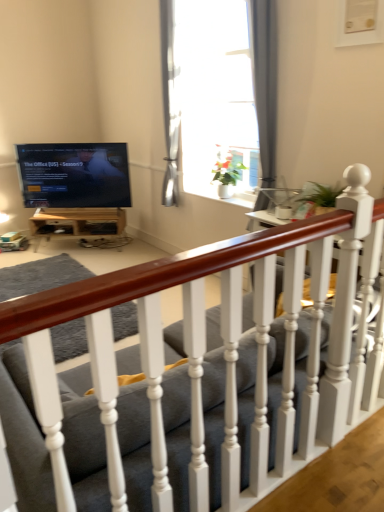
Question: Considering the relative sizes of wooden table at lower left and matte gray fabric couch at center in the image provided, is wooden table at lower left smaller than matte gray fabric couch at center?

Choices:
 (A) yes
 (B) no

Answer: (A)

Question: Considering the relative sizes of wooden table at lower left and matte gray fabric couch at center in the image provided, is wooden table at lower left shorter than matte gray fabric couch at center?

Choices:
 (A) no
 (B) yes

Answer: (B)

Question: Does wooden table at lower left appear on the right side of matte gray fabric couch at center?

Choices:
 (A) yes
 (B) no

Answer: (B)

Question: From a real-world perspective, is wooden table at lower left physically below matte gray fabric couch at center?

Choices:
 (A) yes
 (B) no

Answer: (A)

Question: Is the depth of wooden table at lower left greater than that of matte gray fabric couch at center?

Choices:
 (A) no
 (B) yes

Answer: (B)

Question: From the image's perspective, is white glossy window at upper center above or below wooden table at lower left?

Choices:
 (A) below
 (B) above

Answer: (B)

Question: Looking at their shapes, would you say white glossy window at upper center is wider or thinner than wooden table at lower left?

Choices:
 (A) thin
 (B) wide

Answer: (A)

Question: Is white glossy window at upper center inside or outside of wooden table at lower left?

Choices:
 (A) outside
 (B) inside

Answer: (A)

Question: Is white glossy window at upper center bigger or smaller than wooden table at lower left?

Choices:
 (A) small
 (B) big

Answer: (B)

Question: From the image's perspective, is white glossy window at upper center positioned above or below matte black tv at upper left?

Choices:
 (A) above
 (B) below

Answer: (A)

Question: In terms of size, does white glossy window at upper center appear bigger or smaller than matte black tv at upper left?

Choices:
 (A) small
 (B) big

Answer: (B)

Question: Is white glossy window at upper center spatially inside matte black tv at upper left, or outside of it?

Choices:
 (A) outside
 (B) inside

Answer: (A)

Question: Is point (266, 130) closer or farther from the camera than point (49, 160)?

Choices:
 (A) farther
 (B) closer

Answer: (B)

Question: From the image's perspective, is wooden table at lower left above or below matte black tv at upper left?

Choices:
 (A) above
 (B) below

Answer: (B)

Question: Does point (109, 222) appear closer or farther from the camera than point (77, 180)?

Choices:
 (A) farther
 (B) closer

Answer: (A)